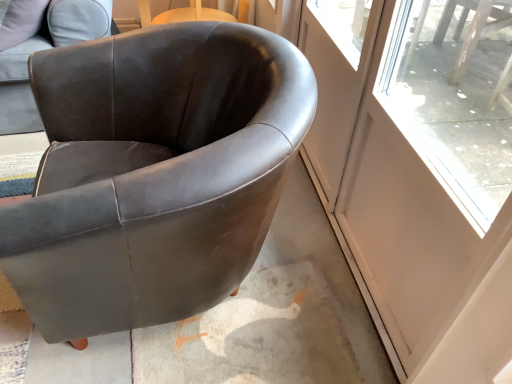
Question: Is the position of suede-like brown armchair at upper left, which is the first chair in left-to-right order, more distant than that of clear glass screen door at upper right, marked as the 1th screen door in a left-to-right arrangement?

Choices:
 (A) no
 (B) yes

Answer: (B)

Question: From a real-world perspective, is suede-like brown armchair at upper left, which is the first chair in left-to-right order, beneath clear glass screen door at upper right, marked as the 1th screen door in a left-to-right arrangement?

Choices:
 (A) yes
 (B) no

Answer: (B)

Question: Considering the relative sizes of suede-like brown armchair at upper left, which is the first chair in left-to-right order, and clear glass screen door at upper right, the 2th screen door in the right-to-left sequence, in the image provided, is suede-like brown armchair at upper left, which is the first chair in left-to-right order, thinner than clear glass screen door at upper right, the 2th screen door in the right-to-left sequence,?

Choices:
 (A) yes
 (B) no

Answer: (B)

Question: Is suede-like brown armchair at upper left, arranged as the 2th chair when viewed from the right, bigger than clear glass screen door at upper right, the 2th screen door in the right-to-left sequence?

Choices:
 (A) no
 (B) yes

Answer: (B)

Question: Considering the relative sizes of suede-like brown armchair at upper left, arranged as the 2th chair when viewed from the right, and clear glass screen door at upper right, the 2th screen door in the right-to-left sequence, in the image provided, is suede-like brown armchair at upper left, arranged as the 2th chair when viewed from the right, smaller than clear glass screen door at upper right, the 2th screen door in the right-to-left sequence,?

Choices:
 (A) yes
 (B) no

Answer: (B)

Question: Does suede-like brown armchair at upper left, arranged as the 2th chair when viewed from the right, have a lesser height compared to clear glass screen door at upper right, marked as the 1th screen door in a left-to-right arrangement?

Choices:
 (A) yes
 (B) no

Answer: (A)

Question: Is transparent glass screen door at right, the first screen door in the right-to-left sequence, positioned behind clear glass screen door at upper right, the 2th screen door in the right-to-left sequence?

Choices:
 (A) yes
 (B) no

Answer: (B)

Question: Can you confirm if transparent glass screen door at right, which appears as the 2th screen door when viewed from the left, is taller than clear glass screen door at upper right, marked as the 1th screen door in a left-to-right arrangement?

Choices:
 (A) no
 (B) yes

Answer: (B)

Question: From the image's perspective, is transparent glass screen door at right, the first screen door in the right-to-left sequence, on clear glass screen door at upper right, the 2th screen door in the right-to-left sequence?

Choices:
 (A) no
 (B) yes

Answer: (A)

Question: Is transparent glass screen door at right, which appears as the 2th screen door when viewed from the left, next to clear glass screen door at upper right, marked as the 1th screen door in a left-to-right arrangement, and touching it?

Choices:
 (A) yes
 (B) no

Answer: (B)

Question: Considering the relative sizes of transparent glass screen door at right, the first screen door in the right-to-left sequence, and clear glass screen door at upper right, marked as the 1th screen door in a left-to-right arrangement, in the image provided, is transparent glass screen door at right, the first screen door in the right-to-left sequence, bigger than clear glass screen door at upper right, marked as the 1th screen door in a left-to-right arrangement,?

Choices:
 (A) no
 (B) yes

Answer: (B)

Question: From a real-world perspective, is transparent glass screen door at right, which appears as the 2th screen door when viewed from the left, located higher than clear glass screen door at upper right, the 2th screen door in the right-to-left sequence?

Choices:
 (A) yes
 (B) no

Answer: (A)

Question: Is transparent glass screen door at right, which appears as the 2th screen door when viewed from the left, surrounding matte black armchair at center, positioned as the second chair in left-to-right order?

Choices:
 (A) yes
 (B) no

Answer: (B)